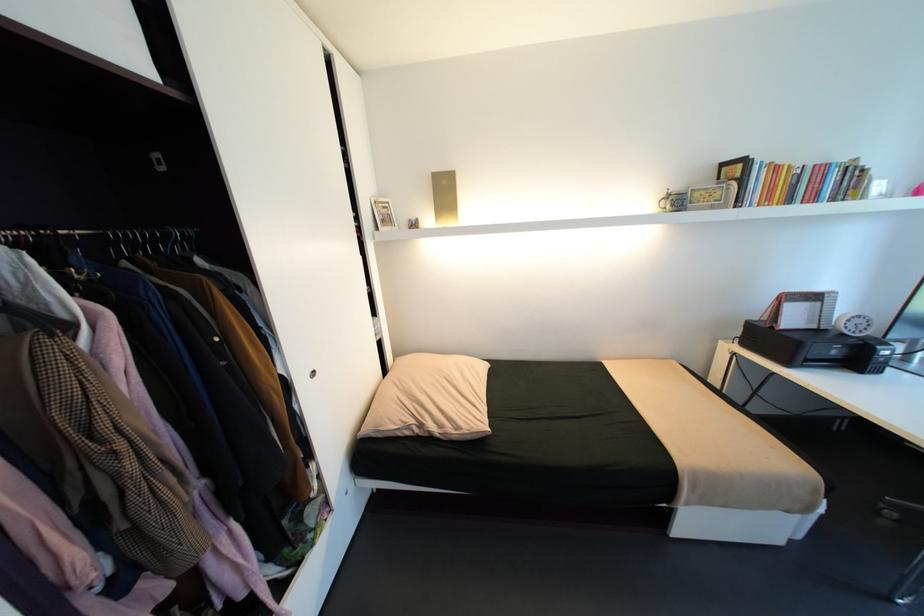
Describe the element at coordinates (674, 200) in the screenshot. I see `the small white mug` at that location.